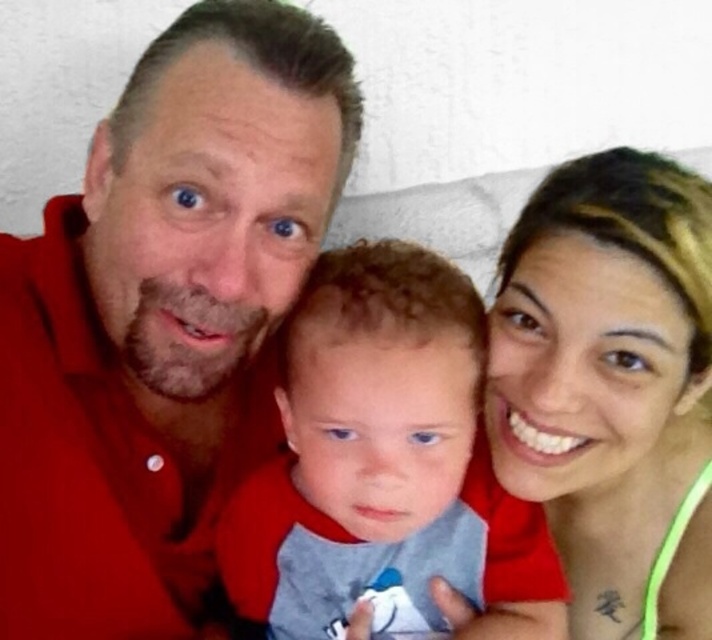
Question: Which is nearer to the smooth skin face at upper right?

Choices:
 (A) soft cotton shirt at center
 (B) matte red shirt at center

Answer: (A)

Question: Which is farther from the soft cotton shirt at center?

Choices:
 (A) smooth skin face at upper right
 (B) matte red shirt at center

Answer: (A)

Question: Which point is farther to the camera?

Choices:
 (A) (671, 436)
 (B) (392, 534)

Answer: (A)

Question: Can you confirm if matte red shirt at center is positioned below soft cotton shirt at center?

Choices:
 (A) yes
 (B) no

Answer: (B)

Question: Considering the relative positions of matte red shirt at center and smooth skin face at upper right in the image provided, where is matte red shirt at center located with respect to smooth skin face at upper right?

Choices:
 (A) right
 (B) left

Answer: (B)

Question: Observing the image, what is the correct spatial positioning of matte red shirt at center in reference to soft cotton shirt at center?

Choices:
 (A) above
 (B) below

Answer: (A)